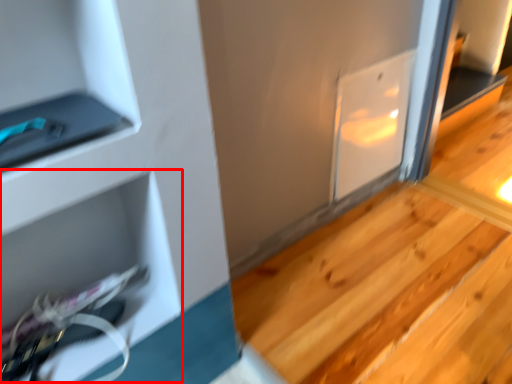
Question: From the image's perspective, what is the correct spatial positioning of shelf (annotated by the red box) in reference to stair?

Choices:
 (A) above
 (B) below

Answer: (A)